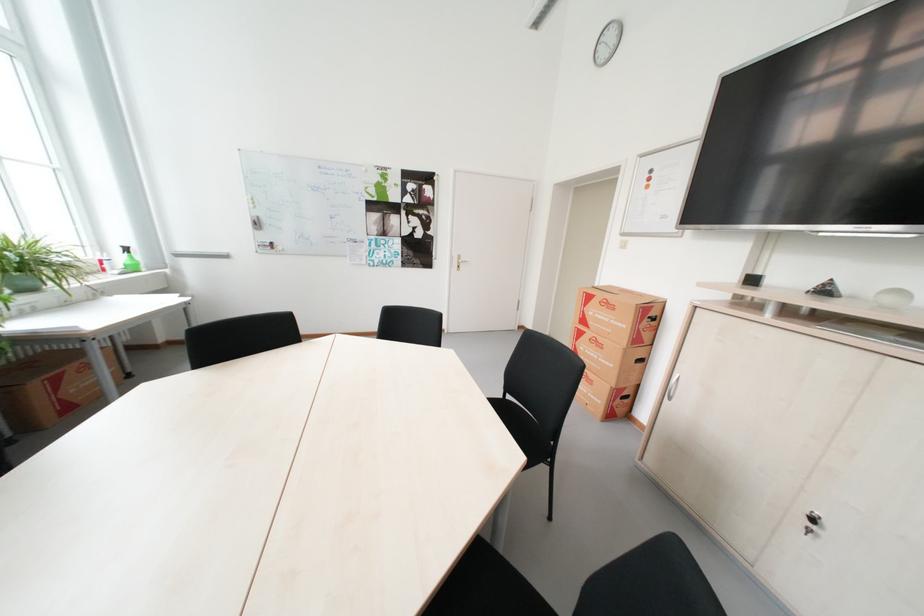
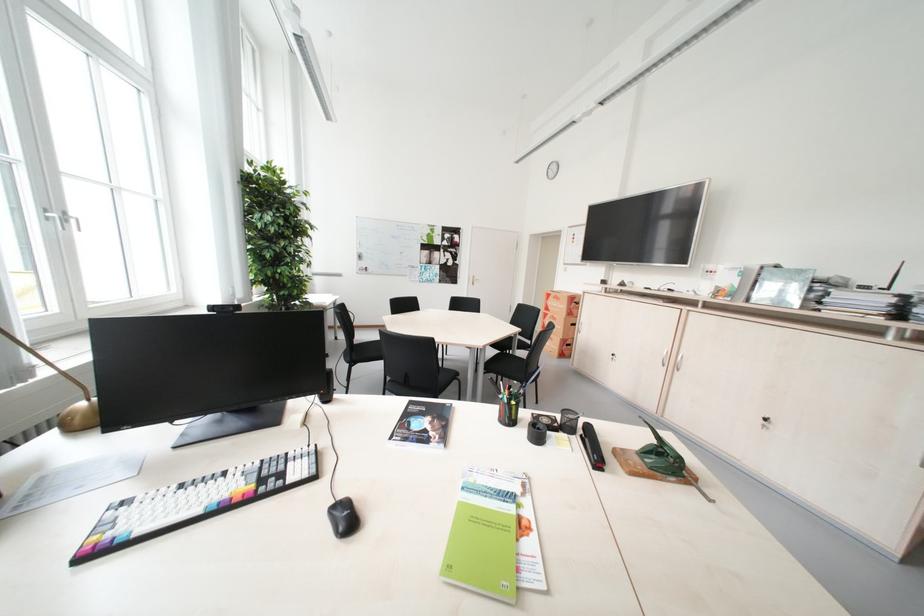
Question: I am providing you with two images of the same scene from different viewpoints. Which of the following objects are not visible in image2?

Choices:
 (A) green press handle
 (B) black chair sitting surface
 (C) green spray bottle
 (D) pink bag zipper

Answer: (C)